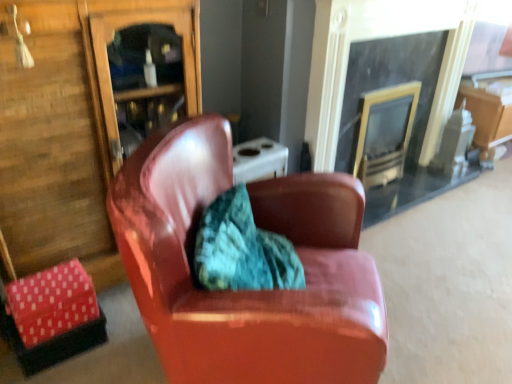
Question: Are shiny leather armchair at center and black glass fireplace at upper right located far from each other?

Choices:
 (A) no
 (B) yes

Answer: (B)

Question: Is shiny leather armchair at center touching black glass fireplace at upper right?

Choices:
 (A) no
 (B) yes

Answer: (A)

Question: Is shiny leather armchair at center wider than black glass fireplace at upper right?

Choices:
 (A) no
 (B) yes

Answer: (B)

Question: Considering the relative positions of shiny leather armchair at center and black glass fireplace at upper right in the image provided, is shiny leather armchair at center to the right of black glass fireplace at upper right from the viewer's perspective?

Choices:
 (A) no
 (B) yes

Answer: (A)

Question: Can you confirm if shiny leather armchair at center is bigger than black glass fireplace at upper right?

Choices:
 (A) no
 (B) yes

Answer: (B)

Question: Is shiny leather armchair at center behind black glass fireplace at upper right?

Choices:
 (A) no
 (B) yes

Answer: (A)

Question: Is the surface of black glass fireplace at upper right in direct contact with shiny leather armchair at center?

Choices:
 (A) no
 (B) yes

Answer: (A)

Question: Is black glass fireplace at upper right further to the viewer compared to shiny leather armchair at center?

Choices:
 (A) no
 (B) yes

Answer: (B)

Question: Could shiny leather armchair at center be considered to be inside black glass fireplace at upper right?

Choices:
 (A) yes
 (B) no

Answer: (B)

Question: Considering the relative sizes of black glass fireplace at upper right and shiny leather armchair at center in the image provided, is black glass fireplace at upper right shorter than shiny leather armchair at center?

Choices:
 (A) no
 (B) yes

Answer: (A)

Question: Is black glass fireplace at upper right wider than shiny leather armchair at center?

Choices:
 (A) yes
 (B) no

Answer: (B)

Question: Is black glass fireplace at upper right at the left side of shiny leather armchair at center?

Choices:
 (A) no
 (B) yes

Answer: (A)

Question: In terms of height, does black glass fireplace at upper right look taller or shorter compared to shiny leather armchair at center?

Choices:
 (A) tall
 (B) short

Answer: (A)